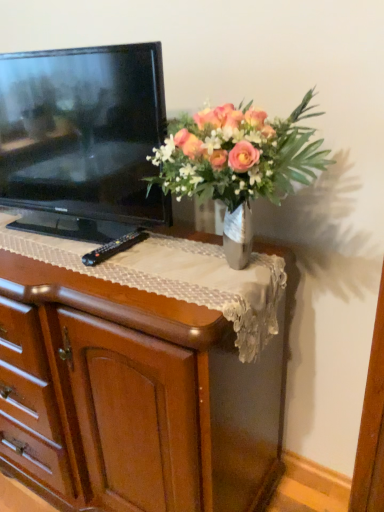
Question: Is wooden chest of drawers at center oriented away from metallic vase at upper center?

Choices:
 (A) yes
 (B) no

Answer: (B)

Question: Would you consider wooden chest of drawers at center to be distant from metallic vase at upper center?

Choices:
 (A) yes
 (B) no

Answer: (B)

Question: Does wooden chest of drawers at center have a smaller size compared to metallic vase at upper center?

Choices:
 (A) yes
 (B) no

Answer: (B)

Question: Does wooden chest of drawers at center appear on the right side of metallic vase at upper center?

Choices:
 (A) no
 (B) yes

Answer: (A)

Question: Considering the relative sizes of wooden chest of drawers at center and metallic vase at upper center in the image provided, is wooden chest of drawers at center shorter than metallic vase at upper center?

Choices:
 (A) no
 (B) yes

Answer: (A)

Question: Considering their positions, is black glossy television at left located in front of or behind black plastic remote at center?

Choices:
 (A) front
 (B) behind

Answer: (A)

Question: Looking at their shapes, would you say black glossy television at left is wider or thinner than black plastic remote at center?

Choices:
 (A) wide
 (B) thin

Answer: (A)

Question: From the image's perspective, is black glossy television at left located above or below black plastic remote at center?

Choices:
 (A) below
 (B) above

Answer: (B)

Question: Considering the positions of black glossy television at left and black plastic remote at center in the image, is black glossy television at left taller or shorter than black plastic remote at center?

Choices:
 (A) short
 (B) tall

Answer: (B)

Question: Is wooden chest of drawers at center bigger or smaller than black glossy television at left?

Choices:
 (A) big
 (B) small

Answer: (A)

Question: Relative to black glossy television at left, is wooden chest of drawers at center in front or behind?

Choices:
 (A) behind
 (B) front

Answer: (B)

Question: Considering the positions of wooden chest of drawers at center and black glossy television at left in the image, is wooden chest of drawers at center wider or thinner than black glossy television at left?

Choices:
 (A) thin
 (B) wide

Answer: (B)

Question: In terms of height, does wooden chest of drawers at center look taller or shorter compared to black glossy television at left?

Choices:
 (A) tall
 (B) short

Answer: (A)

Question: From the image's perspective, relative to metallic vase at upper center, is black glossy television at left above or below?

Choices:
 (A) below
 (B) above

Answer: (B)

Question: Is black glossy television at left inside or outside of metallic vase at upper center?

Choices:
 (A) inside
 (B) outside

Answer: (B)